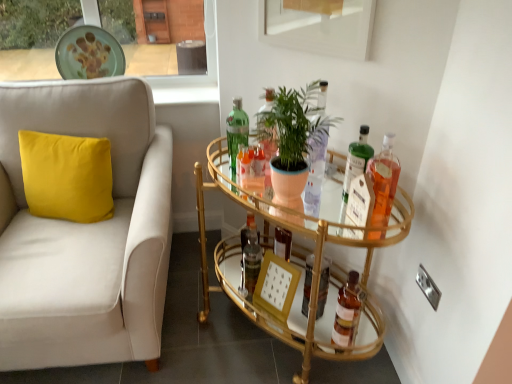
The height and width of the screenshot is (384, 512). Describe the element at coordinates (294, 127) in the screenshot. I see `green matte plant at center` at that location.

What is the approximate height of green matte plate at upper center?

12.36 inches.

You are a GUI agent. You are given a task and a screenshot of the screen. Output one action in this format:
    pyautogui.click(x=<x>, y=<y>)
    Task: Click on the translucent glass bottle at upper right, marked as the first bottle in a right-to-left arrangement
    The height and width of the screenshot is (384, 512).
    Given the screenshot: What is the action you would take?
    pyautogui.click(x=384, y=181)

What do you see at coordinates (347, 311) in the screenshot? I see `brown glass bottle at lower right, which is counted as the 4th bottle, starting from the left` at bounding box center [347, 311].

In order to face wooden picture frame at center, should I rotate leftwards or rightwards?

Rotate right and turn 3.666 degrees.

Describe the element at coordinates (276, 286) in the screenshot. I see `wooden picture frame at center` at that location.

Locate an element on the screen. The width and height of the screenshot is (512, 384). gold glass bar cart at center is located at coordinates pyautogui.click(x=313, y=264).

There is a gold glass bar cart at center. In order to click on studio couch above it (from a real-world perspective) in this screenshot , I will do [85, 232].

Is gold glass bar cart at center positioned far away from white fabric couch at left?

Actually, gold glass bar cart at center and white fabric couch at left are a little close together.

Considering the relative sizes of gold glass bar cart at center and white fabric couch at left in the image provided, is gold glass bar cart at center taller than white fabric couch at left?

In fact, gold glass bar cart at center may be shorter than white fabric couch at left.

What's the angular difference between gold glass bar cart at center and white fabric couch at left's facing directions?

gold glass bar cart at center and white fabric couch at left are facing 42.2 degrees away from each other.

From a real-world perspective, is gold glass bar cart at center positioned over translucent glass bottle at upper right, which is counted as the 3th bottle, starting from the right, based on gravity?

No, from a real-world perspective, gold glass bar cart at center is not above translucent glass bottle at upper right, which is counted as the 3th bottle, starting from the right.

Could you tell me if gold glass bar cart at center is turned towards translucent glass bottle at upper right, which is counted as the 3th bottle, starting from the right?

No, gold glass bar cart at center is not facing towards translucent glass bottle at upper right, which is counted as the 3th bottle, starting from the right.

From the image's perspective, which is below, gold glass bar cart at center or translucent glass bottle at upper right, the third bottle when ordered from left to right?

gold glass bar cart at center is shown below in the image.

Is green matte plate at upper center taller than translucent glass bottle at upper right, which is counted as the 3th bottle, starting from the right?

Yes.

Find the location of a particular element. The image size is (512, 384). plate that appears above the translucent glass bottle at upper right, which is counted as the 3th bottle, starting from the right (from a real-world perspective) is located at coordinates [x=89, y=54].

Measure the distance between green matte plate at upper center and translucent glass bottle at upper right, the third bottle when ordered from left to right.

green matte plate at upper center and translucent glass bottle at upper right, the third bottle when ordered from left to right, are 1.29 meters apart from each other.

Is green matte plate at upper center positioned far away from translucent glass bottle at upper right, which is counted as the 3th bottle, starting from the right?

green matte plate at upper center is far away from translucent glass bottle at upper right, which is counted as the 3th bottle, starting from the right.

Is green matte plate at upper center at the back of white fabric couch at left?

Absolutely, white fabric couch at left is directed away from green matte plate at upper center.

From the image's perspective, does white fabric couch at left appear higher than green matte plate at upper center?

No.

Looking at this image, considering the positions of objects white fabric couch at left and green matte plate at upper center in the image provided, who is more to the left, white fabric couch at left or green matte plate at upper center?

Positioned to the left is white fabric couch at left.

Is white fabric couch at left further to the viewer compared to green matte plate at upper center?

No, it is not.

Is gold glass bar cart at center not within brown glass bottle at lower right, placed as the 2th bottle when sorted from right to left?

Yes, gold glass bar cart at center is outside of brown glass bottle at lower right, placed as the 2th bottle when sorted from right to left.

Which of these two, gold glass bar cart at center or brown glass bottle at lower right, placed as the 2th bottle when sorted from right to left, is smaller?

With smaller size is brown glass bottle at lower right, placed as the 2th bottle when sorted from right to left.

Is gold glass bar cart at center shorter than brown glass bottle at lower right, placed as the 2th bottle when sorted from right to left?

No.

Does green glass bottle at center, positioned as the fifth bottle in right-to-left order, have a lesser height compared to gold glass bar cart at center?

Yes, green glass bottle at center, positioned as the fifth bottle in right-to-left order, is shorter than gold glass bar cart at center.

In the image, is green glass bottle at center, the 1th bottle in the left-to-right sequence, on the left side or the right side of gold glass bar cart at center?

In the image, green glass bottle at center, the 1th bottle in the left-to-right sequence, appears on the left side of gold glass bar cart at center.

Is green glass bottle at center, positioned as the fifth bottle in right-to-left order, far away from gold glass bar cart at center?

No.

Does green glass bottle at center, positioned as the fifth bottle in right-to-left order, lie behind gold glass bar cart at center?

Yes, green glass bottle at center, positioned as the fifth bottle in right-to-left order, is further from the viewer.

Which is behind, point (392, 191) or point (364, 131)?

Point (364, 131)

Which is correct: translucent glass bottle at upper right, the 5th bottle from the left, is inside translucent glass bottle at upper right, the third bottle when ordered from left to right, or outside of it?

translucent glass bottle at upper right, the 5th bottle from the left, is not inside translucent glass bottle at upper right, the third bottle when ordered from left to right, it's outside.

Is translucent glass bottle at upper right, the 5th bottle from the left, positioned behind translucent glass bottle at upper right, the third bottle when ordered from left to right?

No, translucent glass bottle at upper right, the 5th bottle from the left, is closer to the viewer.

Does translucent glass bottle at upper right, the 5th bottle from the left, have a lesser height compared to translucent glass bottle at upper right, which is counted as the 3th bottle, starting from the right?

In fact, translucent glass bottle at upper right, the 5th bottle from the left, may be taller than translucent glass bottle at upper right, which is counted as the 3th bottle, starting from the right.

Identify the location of studio couch that is above the gold glass bar cart at center (from a real-world perspective). (85, 232).

Where is `table that appears in front of the translucent glass bottle at upper right, the third bottle when ordered from left to right`? table that appears in front of the translucent glass bottle at upper right, the third bottle when ordered from left to right is located at coordinates (313, 264).

Estimate the real-world distances between objects in this image. Which object is closer to gold glass bar cart at center, white fabric couch at left or brown glass bottle at lower right, placed as the 2th bottle when sorted from right to left?

brown glass bottle at lower right, placed as the 2th bottle when sorted from right to left.

From the image, which object appears to be farther from brown glass bottle at lower right, placed as the 2th bottle when sorted from right to left, green glass bottle at center, positioned as the fifth bottle in right-to-left order, or green matte plate at upper center?

green matte plate at upper center lies further to brown glass bottle at lower right, placed as the 2th bottle when sorted from right to left, than the other object.

Based on their spatial positions, is wooden picture frame at center or translucent glass bottle at upper right, the 5th bottle from the left, further from translucent glass bottle at upper right, which is counted as the 3th bottle, starting from the right?

wooden picture frame at center lies further to translucent glass bottle at upper right, which is counted as the 3th bottle, starting from the right, than the other object.

Based on the photo, which object lies nearer to the anchor point translucent glass bottle at upper right, marked as the first bottle in a right-to-left arrangement, wooden picture frame at center or brown glass bottle at lower right, which is counted as the 4th bottle, starting from the left?

wooden picture frame at center.

From the image, which object appears to be nearer to translucent glass bottle at upper right, the third bottle when ordered from left to right, green glass bottle at center, positioned as the fifth bottle in right-to-left order, or white fabric couch at left?

green glass bottle at center, positioned as the fifth bottle in right-to-left order, lies closer to translucent glass bottle at upper right, the third bottle when ordered from left to right, than the other object.

When comparing their distances from translucent glass bottle at center, the fourth bottle in the right-to-left sequence, does translucent glass bottle at upper right, marked as the first bottle in a right-to-left arrangement, or green matte plant at center seem further?

Among the two, translucent glass bottle at upper right, marked as the first bottle in a right-to-left arrangement, is located further to translucent glass bottle at center, the fourth bottle in the right-to-left sequence.

Looking at the image, which one is located further to translucent glass bottle at center, the second bottle positioned from the left, translucent glass bottle at upper right, which is counted as the 3th bottle, starting from the right, or green matte plate at upper center?

Among the two, green matte plate at upper center is located further to translucent glass bottle at center, the second bottle positioned from the left.

Based on their spatial positions, is green matte plate at upper center or green glass bottle at center, positioned as the fifth bottle in right-to-left order, closer to translucent glass bottle at upper right, marked as the first bottle in a right-to-left arrangement?

Based on the image, green glass bottle at center, positioned as the fifth bottle in right-to-left order, appears to be nearer to translucent glass bottle at upper right, marked as the first bottle in a right-to-left arrangement.

Find the location of `houseplant between green matte plate at upper center and brown glass bottle at lower right, placed as the 2th bottle when sorted from right to left, in the horizontal direction`. houseplant between green matte plate at upper center and brown glass bottle at lower right, placed as the 2th bottle when sorted from right to left, in the horizontal direction is located at coordinates (294, 127).

The image size is (512, 384). What are the coordinates of `table that lies between green glass bottle at center, positioned as the fifth bottle in right-to-left order, and brown glass bottle at lower right, placed as the 2th bottle when sorted from right to left, from top to bottom` in the screenshot? It's located at point(313,264).

Where is `table that lies between green matte plate at upper center and wooden picture frame at center from top to bottom`? The image size is (512, 384). table that lies between green matte plate at upper center and wooden picture frame at center from top to bottom is located at coordinates coord(313,264).

Identify the location of picture frame between green matte plate at upper center and translucent glass bottle at upper right, marked as the first bottle in a right-to-left arrangement, in the horizontal direction. This screenshot has width=512, height=384. (276, 286).